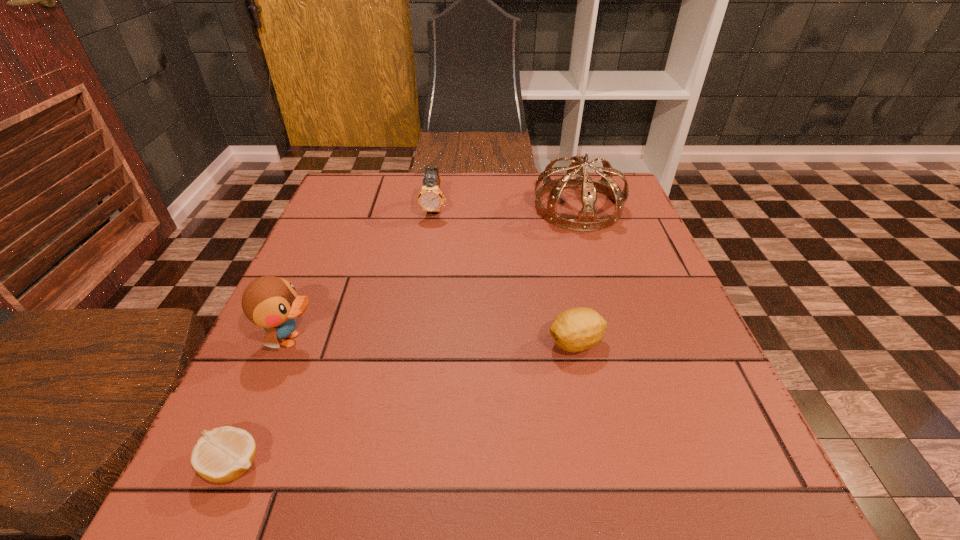
You are a GUI agent. You are given a task and a screenshot of the screen. Output one action in this format:
    pyautogui.click(x=<x>, y=<y>)
    Task: Click on the third closest object to the left lemon
    
    Given the screenshot: What is the action you would take?
    pyautogui.click(x=430, y=198)

Where is `free space in the image that satisfies the following two spatial constraints: 1. at the stem end of the farther lemon; 2. on the front side of the left lemon`? free space in the image that satisfies the following two spatial constraints: 1. at the stem end of the farther lemon; 2. on the front side of the left lemon is located at coordinates (602, 465).

At what (x,y) coordinates should I click in order to perform the action: click on vacant point that satisfies the following two spatial constraints: 1. on the front side of the tiara; 2. on the front-facing side of the duck. Please return your answer as a coordinate pair (x, y). This screenshot has width=960, height=540. Looking at the image, I should click on (619, 340).